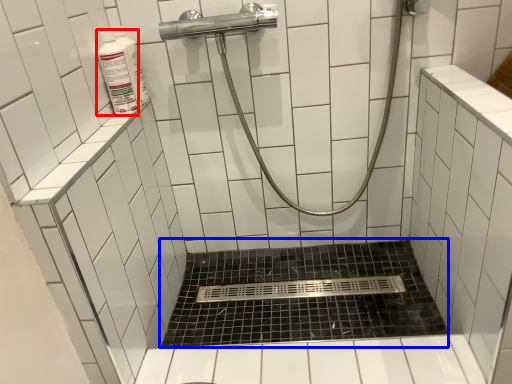
Question: Which point is further to the camera, cleaning product (highlighted by a red box) or bath (highlighted by a blue box)?

Choices:
 (A) cleaning product
 (B) bath

Answer: (B)